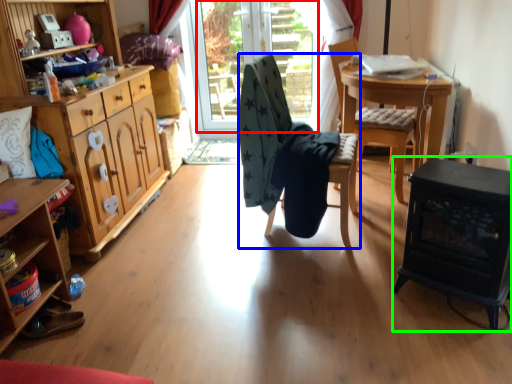
Question: Which object is the closest to the window screen (highlighted by a red box)? Choose among these: chair (highlighted by a blue box) or fireplace (highlighted by a green box).

Choices:
 (A) chair
 (B) fireplace

Answer: (A)